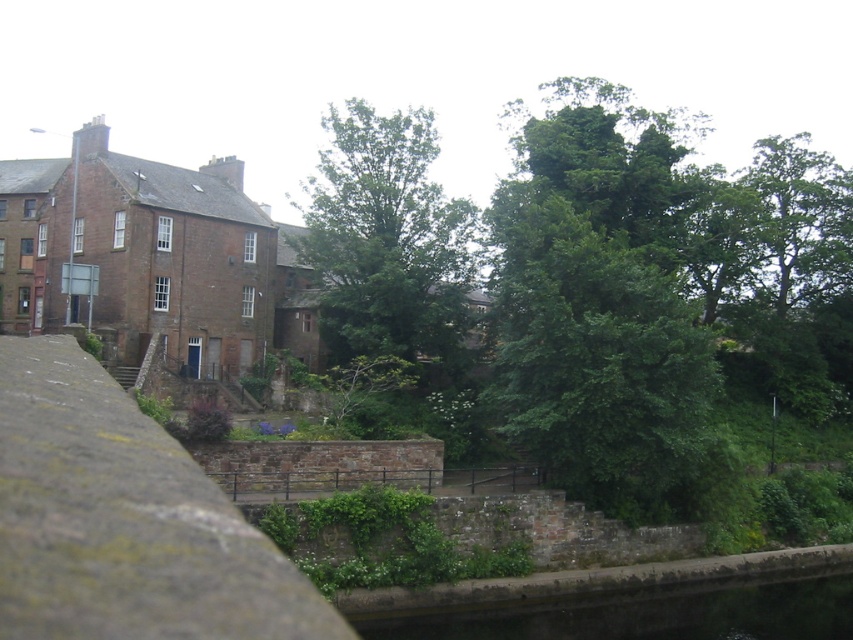
Question: Is green leafy tree at center bigger than green concrete waterway at lower center?

Choices:
 (A) no
 (B) yes

Answer: (B)

Question: Where is green leafy tree at center located in relation to green concrete waterway at lower center in the image?

Choices:
 (A) below
 (B) above

Answer: (B)

Question: Can you confirm if green leafy tree at center is wider than green concrete waterway at lower center?

Choices:
 (A) yes
 (B) no

Answer: (A)